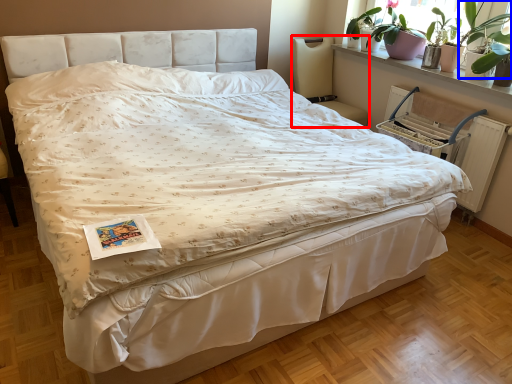
Question: Among these objects, which one is nearest to the camera, chair (highlighted by a red box) or plant (highlighted by a blue box)?

Choices:
 (A) chair
 (B) plant

Answer: (B)